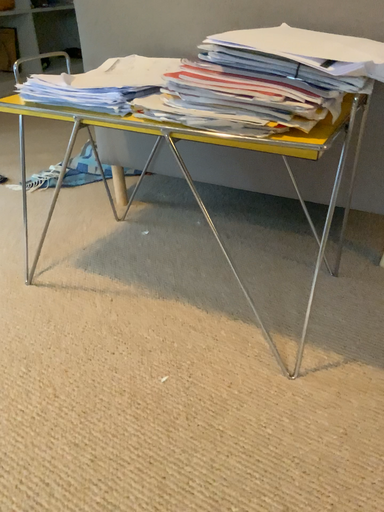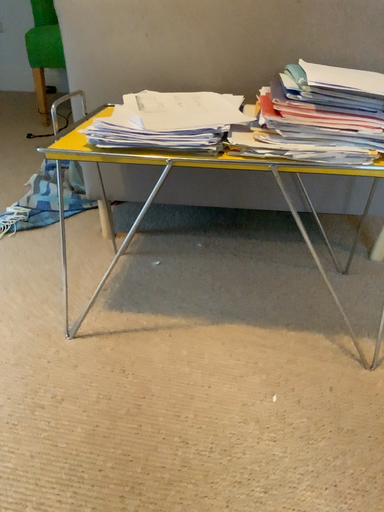
Question: Which way did the camera rotate in the video?

Choices:
 (A) rotated right
 (B) rotated left

Answer: (A)